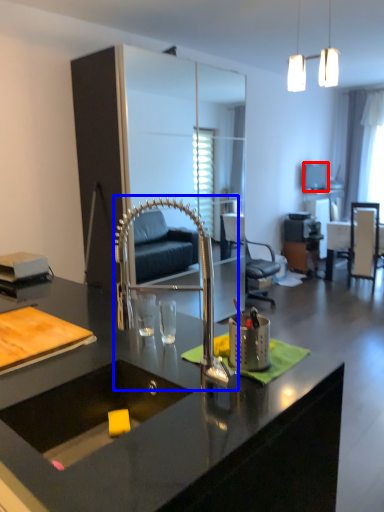
Question: Which point is further to the camera, television (highlighted by a red box) or faucet (highlighted by a blue box)?

Choices:
 (A) television
 (B) faucet

Answer: (A)